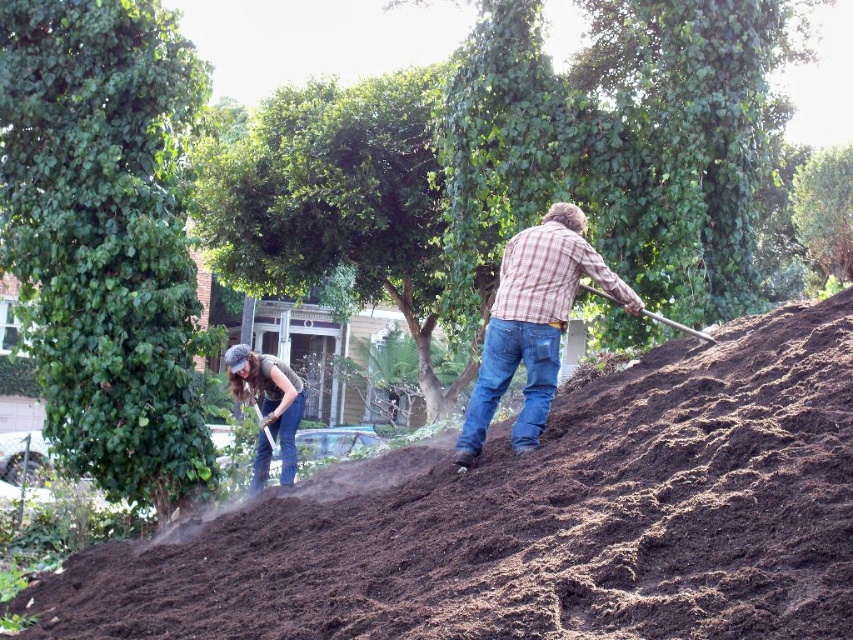
Question: Which of the following is the farthest from the observer?

Choices:
 (A) wooden shovel at upper right
 (B) denim jeans at lower left
 (C) plaid flannel shirt at upper center
 (D) dark brown soil at center

Answer: (B)

Question: Which is farther from the plaid flannel shirt at upper center?

Choices:
 (A) denim jeans at lower left
 (B) dark brown soil at center
 (C) wooden shovel at upper right

Answer: (A)

Question: Considering the real-world distances, which object is closest to the dark brown soil at center?

Choices:
 (A) denim jeans at lower left
 (B) wooden shovel at upper right
 (C) plaid flannel shirt at upper center

Answer: (C)

Question: Can you confirm if plaid flannel shirt at upper center is wider than denim jeans at lower left?

Choices:
 (A) yes
 (B) no

Answer: (A)

Question: In this image, where is dark brown soil at center located relative to plaid flannel shirt at upper center?

Choices:
 (A) below
 (B) above

Answer: (A)

Question: From the image, what is the correct spatial relationship of dark brown soil at center in relation to denim jeans at lower left?

Choices:
 (A) right
 (B) left

Answer: (A)